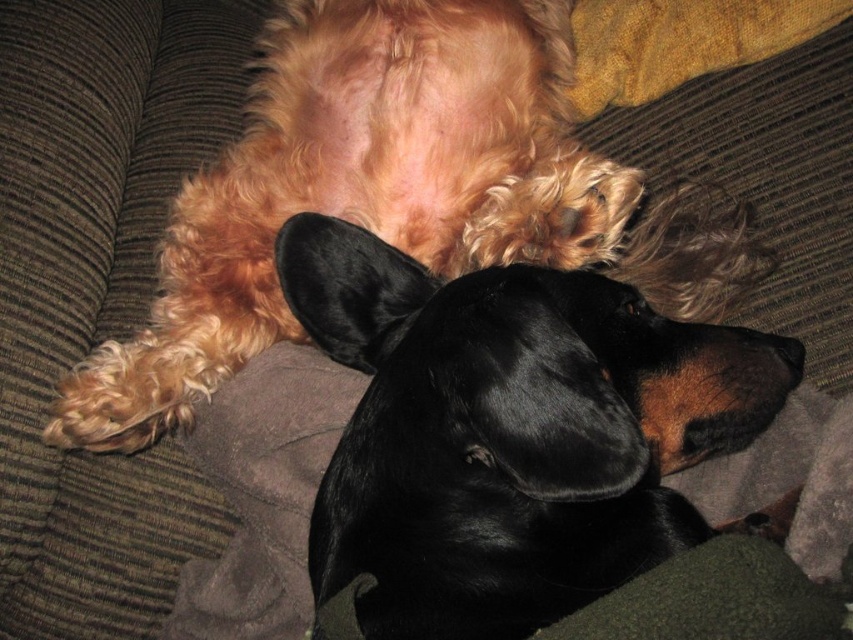
You are a dog owner who wants to place a small toy between the black shiny dog at center and the fluffy golden dog at upper center. Can you fit the toy there if the toy is 10 inches long?

The distance between the black shiny dog at center and the fluffy golden dog at upper center is 8.89 inches, so the toy which is 10 inches long cannot fit between them as it is longer than the space available.

You are a dog owner who wants to buy a new dog bed for your two dogs. The bed must accommodate both the black shiny dog at center and the fluffy golden dog at upper center. Based on their sizes, which dog requires a larger bed?

The fluffy golden dog at upper center requires a larger bed since its width is greater than the black shiny dog at center.